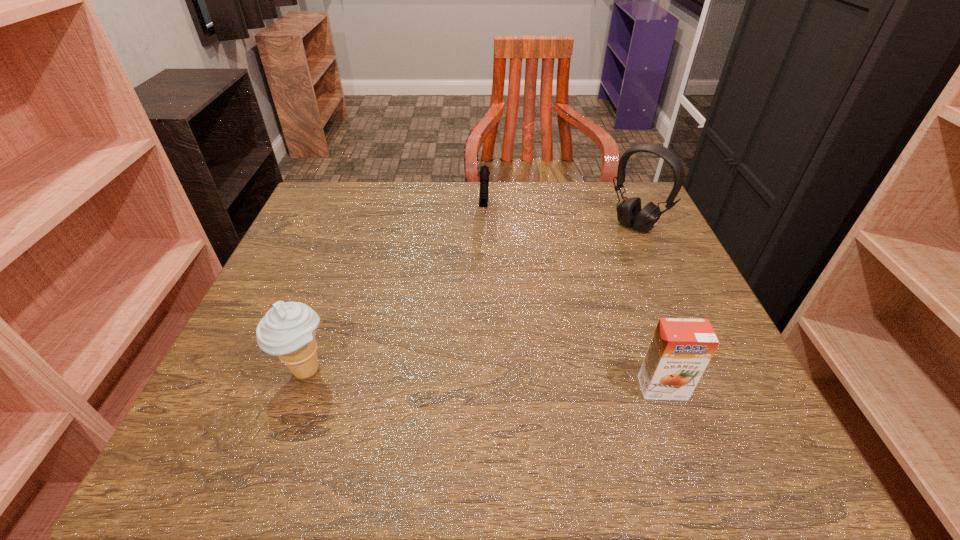
The width and height of the screenshot is (960, 540). In order to click on free area in between the orange juice and the third object from right to left in this screenshot , I will do `click(573, 300)`.

Locate an element on the screen. The width and height of the screenshot is (960, 540). vacant space in between the tallest object and the pistol is located at coordinates (560, 219).

At what (x,y) coordinates should I click in order to perform the action: click on empty space that is in between the third tallest object and the shortest object. Please return your answer as a coordinate pair (x, y). The height and width of the screenshot is (540, 960). Looking at the image, I should click on (573, 300).

Identify the location of unoccupied position between the shortest object and the leftmost object. The width and height of the screenshot is (960, 540). (396, 292).

Locate an element on the screen. Image resolution: width=960 pixels, height=540 pixels. free space that is in between the icecream and the tallest object is located at coordinates (470, 298).

At what (x,y) coordinates should I click in order to perform the action: click on blank region between the tallest object and the second object from left to right. Please return your answer as a coordinate pair (x, y). Looking at the image, I should click on (560, 219).

Find the location of a particular element. The width and height of the screenshot is (960, 540). vacant area that lies between the tallest object and the third tallest object is located at coordinates (649, 307).

You are a GUI agent. You are given a task and a screenshot of the screen. Output one action in this format:
    pyautogui.click(x=<x>, y=<y>)
    Task: Click on the blank region between the pistol and the leftmost object
    Image resolution: width=960 pixels, height=540 pixels.
    Given the screenshot: What is the action you would take?
    pyautogui.click(x=396, y=292)

I want to click on the third closest object to the tallest object, so click(287, 330).

Locate an element on the screen. This screenshot has height=540, width=960. object that is the third closest to the orange juice is located at coordinates (287, 330).